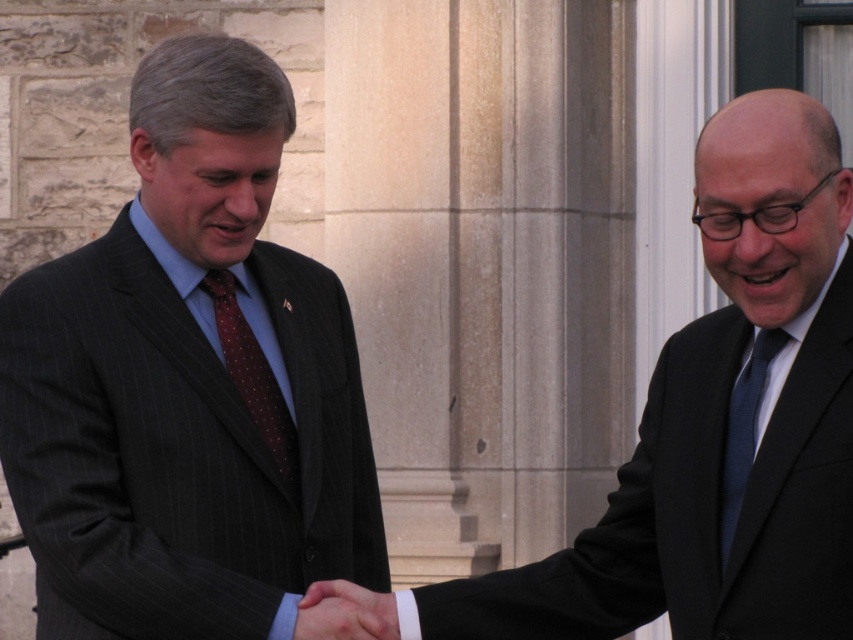
You are a photographer taking a picture of the two men shaking hands. You want to ensure both the dark pinstripe suit at left and the dark blue silk tie at right are clearly visible in the photo. Based on their positions, which one is positioned higher in the frame?

The dark pinstripe suit at left is located above the dark blue silk tie at right, so it is positioned higher in the frame.

You are a photographer at a business event. You need to capture a photo of both the dark pinstripe suit at left and the dark pinstripe suit at center in the same frame. Based on their positions, which one is closer to the camera?

The dark pinstripe suit at left is closer to the camera because the dark pinstripe suit at center is behind it.

You are a photographer taking a picture of the two men. You want to focus on the dark pinstripe suit at left and the dark blue silk tie at right. Which object should you adjust your camera focus on first to ensure both are in focus?

The dark pinstripe suit at left is closer to the viewer than the dark blue silk tie at right. To ensure both are in focus, you should adjust your camera focus on the dark pinstripe suit at left first, as it is closer, and the focus will naturally extend to the farther object.